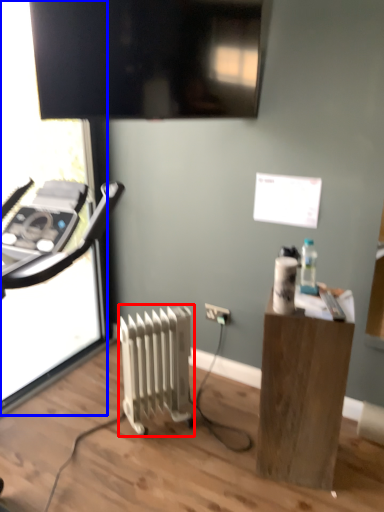
Question: Among these objects, which one is nearest to the camera, radiator (highlighted by a red box) or screen door (highlighted by a blue box)?

Choices:
 (A) radiator
 (B) screen door

Answer: (B)